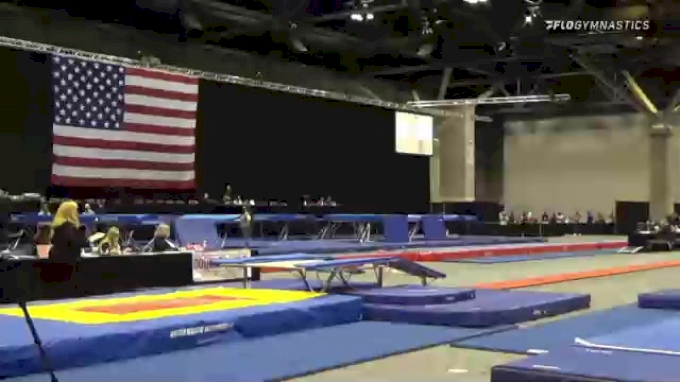
Locate an element on the screen. The height and width of the screenshot is (382, 680). purple mats is located at coordinates (491, 300), (432, 300).